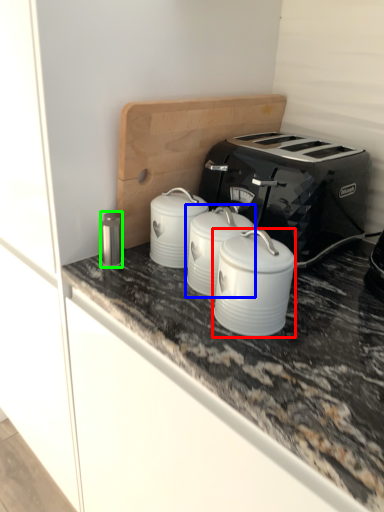
Question: Which is nearer to the appliance (highlighted by a red box)? appliance (highlighted by a blue box) or appliance (highlighted by a green box).

Choices:
 (A) appliance
 (B) appliance

Answer: (A)